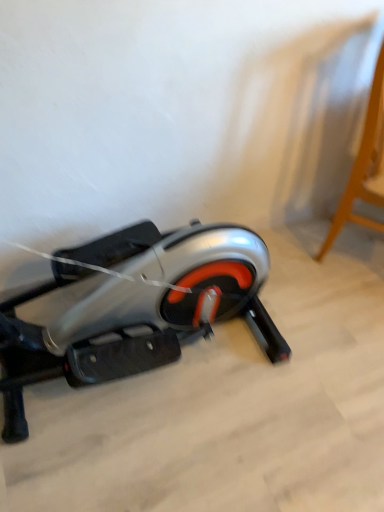
In order to face silver metallic stationary bicycle at lower left, should I rotate leftwards or rightwards?

Turn right approximately 11.032 degrees to face it.

Locate an element on the screen. silver metallic stationary bicycle at lower left is located at coordinates (134, 307).

Describe the element at coordinates (134, 307) in the screenshot. I see `silver metallic stationary bicycle at lower left` at that location.

Measure the distance between point (347, 182) and camera.

The distance of point (347, 182) from camera is 6.85 feet.

This screenshot has width=384, height=512. In order to click on light wood stool at upper right in this screenshot , I will do `click(364, 166)`.

This screenshot has height=512, width=384. What do you see at coordinates (364, 166) in the screenshot? I see `light wood stool at upper right` at bounding box center [364, 166].

I want to click on silver metallic stationary bicycle at lower left, so (x=134, y=307).

Consider the image. Is silver metallic stationary bicycle at lower left to the left or to the right of light wood stool at upper right in the image?

In the image, silver metallic stationary bicycle at lower left appears on the left side of light wood stool at upper right.

Based on the photo, is silver metallic stationary bicycle at lower left positioned behind light wood stool at upper right?

That is False.

Is point (74, 351) positioned in front of point (376, 137)?

Yes, point (74, 351) is in front of point (376, 137).

From the image's perspective, is silver metallic stationary bicycle at lower left located above or below light wood stool at upper right?

From the image's perspective, silver metallic stationary bicycle at lower left appears below light wood stool at upper right.

From a real-world perspective, is silver metallic stationary bicycle at lower left below light wood stool at upper right?

Yes, from a real-world perspective, silver metallic stationary bicycle at lower left is below light wood stool at upper right.

Looking at their sizes, would you say silver metallic stationary bicycle at lower left is wider or thinner than light wood stool at upper right?

silver metallic stationary bicycle at lower left is wider than light wood stool at upper right.

Between silver metallic stationary bicycle at lower left and light wood stool at upper right, which one has less height?

With less height is silver metallic stationary bicycle at lower left.

Considering the relative sizes of silver metallic stationary bicycle at lower left and light wood stool at upper right in the image provided, is silver metallic stationary bicycle at lower left smaller than light wood stool at upper right?

Indeed, silver metallic stationary bicycle at lower left has a smaller size compared to light wood stool at upper right.

Based on the photo, can we say silver metallic stationary bicycle at lower left lies outside light wood stool at upper right?

Absolutely, silver metallic stationary bicycle at lower left is external to light wood stool at upper right.

Is silver metallic stationary bicycle at lower left far away from light wood stool at upper right?

No, there isn't a large distance between silver metallic stationary bicycle at lower left and light wood stool at upper right.

Could you tell me if silver metallic stationary bicycle at lower left is turned towards light wood stool at upper right?

No, silver metallic stationary bicycle at lower left does not turn towards light wood stool at upper right.

At what (x,y) coordinates should I click in order to perform the action: click on furniture on the right of silver metallic stationary bicycle at lower left. Please return your answer as a coordinate pair (x, y). Looking at the image, I should click on (364, 166).

Can you confirm if light wood stool at upper right is positioned to the right of silver metallic stationary bicycle at lower left?

Yes, light wood stool at upper right is to the right of silver metallic stationary bicycle at lower left.

In the image, is light wood stool at upper right positioned in front of or behind silver metallic stationary bicycle at lower left?

In the image, light wood stool at upper right appears behind silver metallic stationary bicycle at lower left.

Between point (349, 192) and point (104, 325), which one is positioned in front?

Point (104, 325)

From the image's perspective, would you say light wood stool at upper right is shown under silver metallic stationary bicycle at lower left?

No, from the image's perspective, light wood stool at upper right is not below silver metallic stationary bicycle at lower left.

From a real-world perspective, who is located lower, light wood stool at upper right or silver metallic stationary bicycle at lower left?

silver metallic stationary bicycle at lower left is physically lower.

From the picture: Does light wood stool at upper right have a greater width compared to silver metallic stationary bicycle at lower left?

In fact, light wood stool at upper right might be narrower than silver metallic stationary bicycle at lower left.

Looking at this image, considering the relative sizes of light wood stool at upper right and silver metallic stationary bicycle at lower left in the image provided, is light wood stool at upper right taller than silver metallic stationary bicycle at lower left?

Correct, light wood stool at upper right is much taller as silver metallic stationary bicycle at lower left.

Based on their sizes in the image, would you say light wood stool at upper right is bigger or smaller than silver metallic stationary bicycle at lower left?

light wood stool at upper right is bigger than silver metallic stationary bicycle at lower left.

Does light wood stool at upper right contain silver metallic stationary bicycle at lower left?

That's incorrect, silver metallic stationary bicycle at lower left is not inside light wood stool at upper right.

Is light wood stool at upper right in contact with silver metallic stationary bicycle at lower left?

light wood stool at upper right and silver metallic stationary bicycle at lower left are clearly separated.

From the picture: Is silver metallic stationary bicycle at lower left at the back of light wood stool at upper right?

No, light wood stool at upper right is not facing away from silver metallic stationary bicycle at lower left.

Can you tell me how much light wood stool at upper right and silver metallic stationary bicycle at lower left differ in facing direction?

The angle between the facing direction of light wood stool at upper right and the facing direction of silver metallic stationary bicycle at lower left is 131 degrees.

Where is `stationary bicycle that is below the light wood stool at upper right (from the image's perspective)`? The image size is (384, 512). stationary bicycle that is below the light wood stool at upper right (from the image's perspective) is located at coordinates (134, 307).

This screenshot has width=384, height=512. Find the location of `furniture that is on the right side of silver metallic stationary bicycle at lower left`. furniture that is on the right side of silver metallic stationary bicycle at lower left is located at coordinates (364, 166).

The image size is (384, 512). Find the location of `stationary bicycle below the light wood stool at upper right (from the image's perspective)`. stationary bicycle below the light wood stool at upper right (from the image's perspective) is located at coordinates (134, 307).